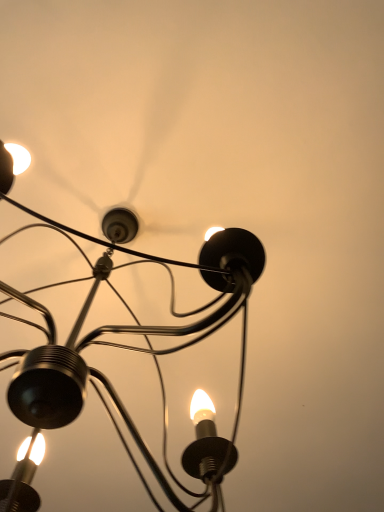
Question: Should I look upward or downward to see matte black chandelier at upper left?

Choices:
 (A) up
 (B) down

Answer: (B)